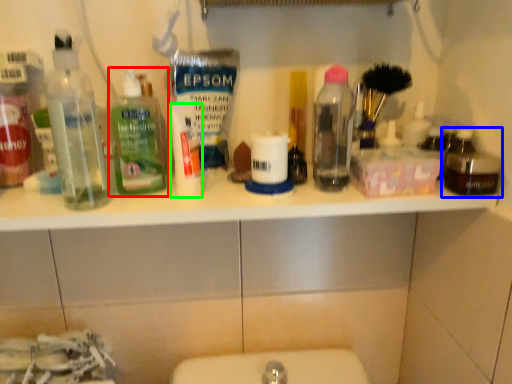
Question: Which object is positioned farthest from bottle (highlighted by a red box)? Select from bottle (highlighted by a blue box) and toiletry (highlighted by a green box).

Choices:
 (A) bottle
 (B) toiletry

Answer: (A)